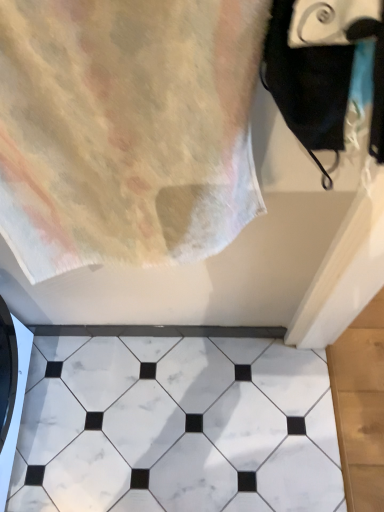
What do you see at coordinates (321, 80) in the screenshot? The height and width of the screenshot is (512, 384). I see `black matte towel at upper right` at bounding box center [321, 80].

Where is `white marble tile at center`? white marble tile at center is located at coordinates (176, 426).

What are the coordinates of `black matte towel at upper right` in the screenshot? It's located at (321, 80).

In the scene shown: From a real-world perspective, which is physically above, white marble tile at center or pastel cotton towel at upper left?

pastel cotton towel at upper left, from a real-world perspective.

How distant is white marble tile at center from pastel cotton towel at upper left?

white marble tile at center and pastel cotton towel at upper left are 31.59 inches apart from each other.

Where is `towel on the left of white marble tile at center`? This screenshot has width=384, height=512. towel on the left of white marble tile at center is located at coordinates (126, 130).

Is point (278, 486) farther from camera compared to point (126, 10)?

Yes, point (278, 486) is farther from viewer.

Is black matte towel at upper right turned away from white marble tile at center?

black matte towel at upper right does not have its back to white marble tile at center.

From the image's perspective, which object appears higher, black matte towel at upper right or white marble tile at center?

black matte towel at upper right.

How many degrees apart are the facing directions of black matte towel at upper right and white marble tile at center?

The angular difference between black matte towel at upper right and white marble tile at center is 90 degrees.

Between point (317, 141) and point (336, 440), which one is positioned behind?

Positioned behind is point (336, 440).

Consider the image. Does black matte towel at upper right come behind pastel cotton towel at upper left?

No, it is in front of pastel cotton towel at upper left.

Is black matte towel at upper right next to pastel cotton towel at upper left and touching it?

They are not placed beside each other.

From the image's perspective, would you say black matte towel at upper right is positioned over pastel cotton towel at upper left?

Yes.

From the image's perspective, which object appears higher, white marble tile at center or black matte towel at upper right?

black matte towel at upper right is shown above in the image.

What's the angular difference between white marble tile at center and black matte towel at upper right's facing directions?

The angle between the facing direction of white marble tile at center and the facing direction of black matte towel at upper right is 90 degrees.

Does point (181, 362) come farther from viewer compared to point (334, 44)?

Yes, point (181, 362) is behind point (334, 44).

Who is shorter, white marble tile at center or black matte towel at upper right?

white marble tile at center is shorter.

Does pastel cotton towel at upper left touch black matte towel at upper right?

No, pastel cotton towel at upper left is not next to black matte towel at upper right.

Considering the positions of objects pastel cotton towel at upper left and black matte towel at upper right in the image provided, who is behind, pastel cotton towel at upper left or black matte towel at upper right?

pastel cotton towel at upper left is further from the camera.

Image resolution: width=384 pixels, height=512 pixels. I want to click on towel located on the left of black matte towel at upper right, so click(126, 130).

The image size is (384, 512). I want to click on towel on the left of white marble tile at center, so click(126, 130).

Based on the photo, in the image, is pastel cotton towel at upper left positioned in front of or behind white marble tile at center?

Clearly, pastel cotton towel at upper left is in front of white marble tile at center.

Consider the image. From a real-world perspective, is pastel cotton towel at upper left on white marble tile at center?

Yes, from a real-world perspective, pastel cotton towel at upper left is above white marble tile at center.

This screenshot has width=384, height=512. Identify the location of towel located above the white marble tile at center (from a real-world perspective). pos(126,130).

At what (x,y) coordinates should I click in order to perform the action: click on marble below the black matte towel at upper right (from the image's perspective). Please return your answer as a coordinate pair (x, y). This screenshot has width=384, height=512. Looking at the image, I should click on (176, 426).

From the image, which object appears to be farther from white marble tile at center, black matte towel at upper right or pastel cotton towel at upper left?

The object further to white marble tile at center is black matte towel at upper right.

Considering their positions, is white marble tile at center positioned further to black matte towel at upper right than pastel cotton towel at upper left?

Among the two, white marble tile at center is located further to black matte towel at upper right.

From the image, which object appears to be nearer to white marble tile at center, pastel cotton towel at upper left or black matte towel at upper right?

Among the two, pastel cotton towel at upper left is located nearer to white marble tile at center.

Which object lies further to the anchor point pastel cotton towel at upper left, white marble tile at center or black matte towel at upper right?

white marble tile at center.

From the image, which object appears to be farther from pastel cotton towel at upper left, black matte towel at upper right or white marble tile at center?

Based on the image, white marble tile at center appears to be further to pastel cotton towel at upper left.

Based on their spatial positions, is pastel cotton towel at upper left or white marble tile at center closer to black matte towel at upper right?

pastel cotton towel at upper left is closer to black matte towel at upper right.

Where is `towel located between black matte towel at upper right and white marble tile at center in the depth direction`? towel located between black matte towel at upper right and white marble tile at center in the depth direction is located at coordinates (126, 130).